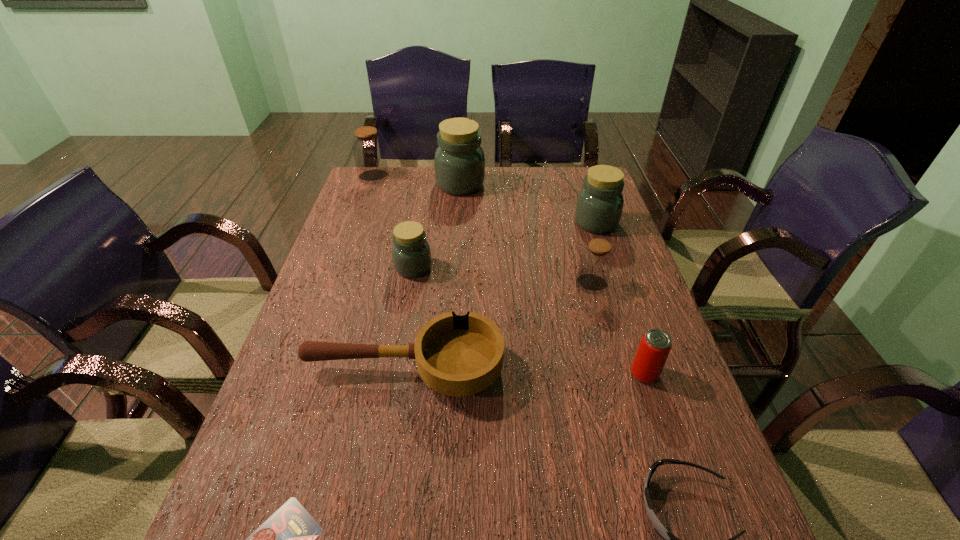
Where is `beer can that is positioned at the right edge`? The height and width of the screenshot is (540, 960). beer can that is positioned at the right edge is located at coordinates click(x=654, y=348).

The height and width of the screenshot is (540, 960). I want to click on object that is at the far left corner, so (368, 148).

In the image, there is a desktop. Identify the location of free space at the far edge. (519, 171).

Find the location of a particular element. The width and height of the screenshot is (960, 540). free space at the near edge of the desktop is located at coordinates (462, 538).

At what (x,y) coordinates should I click in order to perform the action: click on free space at the left edge. Please return your answer as a coordinate pair (x, y). This screenshot has height=540, width=960. Looking at the image, I should click on (340, 384).

This screenshot has width=960, height=540. I want to click on vacant space at the right edge of the desktop, so click(x=612, y=350).

I want to click on vacant space at the far left corner of the desktop, so click(x=398, y=191).

This screenshot has height=540, width=960. Find the location of `free space between the left brown jar and the nearer brown jar`. free space between the left brown jar and the nearer brown jar is located at coordinates (483, 230).

You are a GUI agent. You are given a task and a screenshot of the screen. Output one action in this format:
    pyautogui.click(x=<x>, y=<y>)
    Task: Click on the free space between the right brown jar and the saucepan
    This screenshot has width=960, height=540.
    Given the screenshot: What is the action you would take?
    pyautogui.click(x=498, y=326)

I want to click on free space between the tallest jar and the nearer brown jar, so click(x=526, y=234).